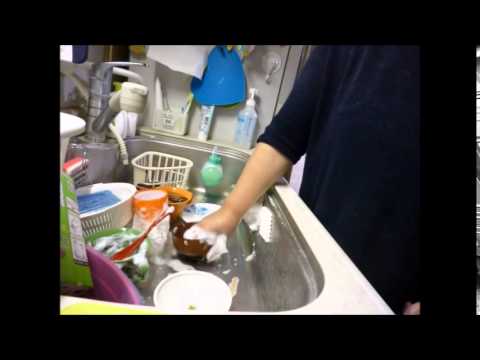
The height and width of the screenshot is (360, 480). I want to click on pump dispenser bottle, so pos(251,102).